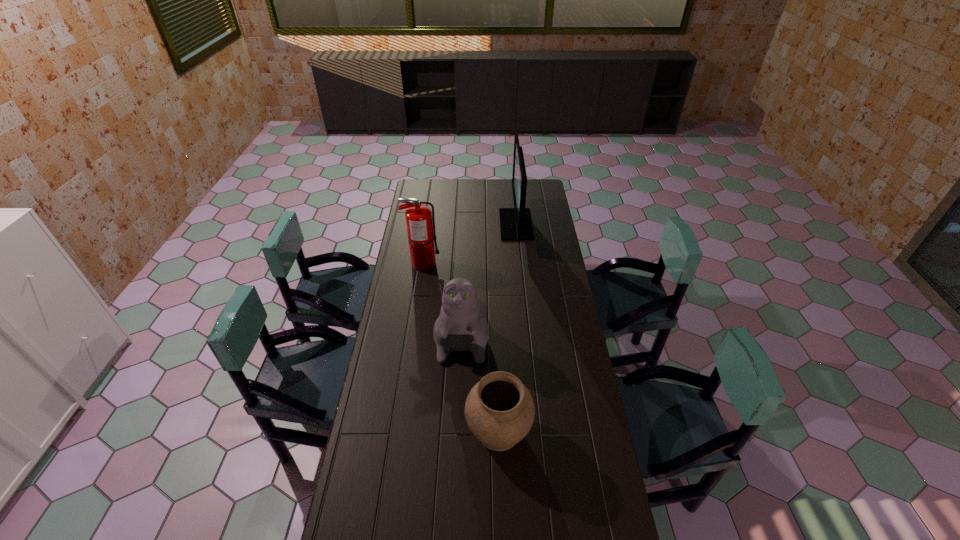
Locate an element on the screen. The image size is (960, 540). vacant region at the far left corner is located at coordinates (417, 194).

This screenshot has height=540, width=960. In the image, there is a desktop. In order to click on vacant area at the far right corner in this screenshot , I will do `click(529, 188)`.

This screenshot has width=960, height=540. Find the location of `empty space that is in between the second farthest object and the monitor`. empty space that is in between the second farthest object and the monitor is located at coordinates (469, 244).

The image size is (960, 540). What are the coordinates of `object that ranks as the closest to the farthest object` in the screenshot? It's located at (460, 326).

Identify which object is located as the nearest to the monitor. Please provide its 2D coordinates. Your answer should be formatted as a tuple, i.e. [(x, y)], where the tuple contains the x and y coordinates of a point satisfying the conditions above.

[(460, 326)]

The image size is (960, 540). What are the coordinates of `free space that satisfies the following two spatial constraints: 1. on the screen side of the monitor; 2. on the face of the second nearest object` in the screenshot? It's located at (526, 327).

The height and width of the screenshot is (540, 960). I want to click on vacant area in the image that satisfies the following two spatial constraints: 1. at the nozzle of the fire extinguisher; 2. on the back side of the nearest object, so click(398, 430).

At what (x,y) coordinates should I click in order to perform the action: click on free space that satisfies the following two spatial constraints: 1. at the nozzle of the leftmost object; 2. on the right side of the shortest object. Please return your answer as a coordinate pair (x, y). Image resolution: width=960 pixels, height=540 pixels. Looking at the image, I should click on (398, 430).

Locate an element on the screen. The image size is (960, 540). free point that satisfies the following two spatial constraints: 1. on the back side of the shortest object; 2. at the nozzle of the second farthest object is located at coordinates (493, 264).